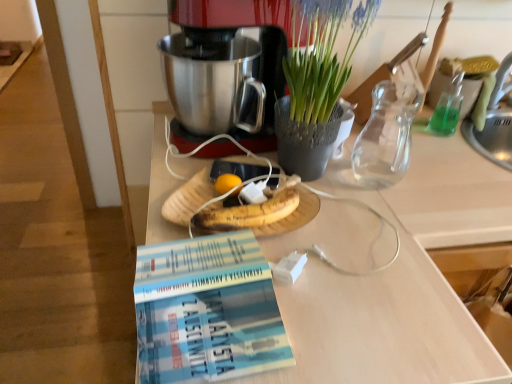
Question: Is point (309, 144) positioned closer to the camera than point (198, 140)?

Choices:
 (A) closer
 (B) farther

Answer: (A)

Question: Is green textured vase at upper center in front of or behind metallic silver coffee maker at center in the image?

Choices:
 (A) behind
 (B) front

Answer: (B)

Question: Considering the real-world distances, which object is closest to the white matte desk at center?

Choices:
 (A) transparent glass vase at upper right
 (B) metallic silver coffee maker at center
 (C) green textured vase at upper center
 (D) blue paperback book at lower center

Answer: (A)

Question: Estimate the real-world distances between objects in this image. Which object is closer to the white matte desk at center?

Choices:
 (A) transparent glass vase at upper right
 (B) blue paperback book at lower center
 (C) metallic silver coffee maker at center
 (D) green textured vase at upper center

Answer: (A)